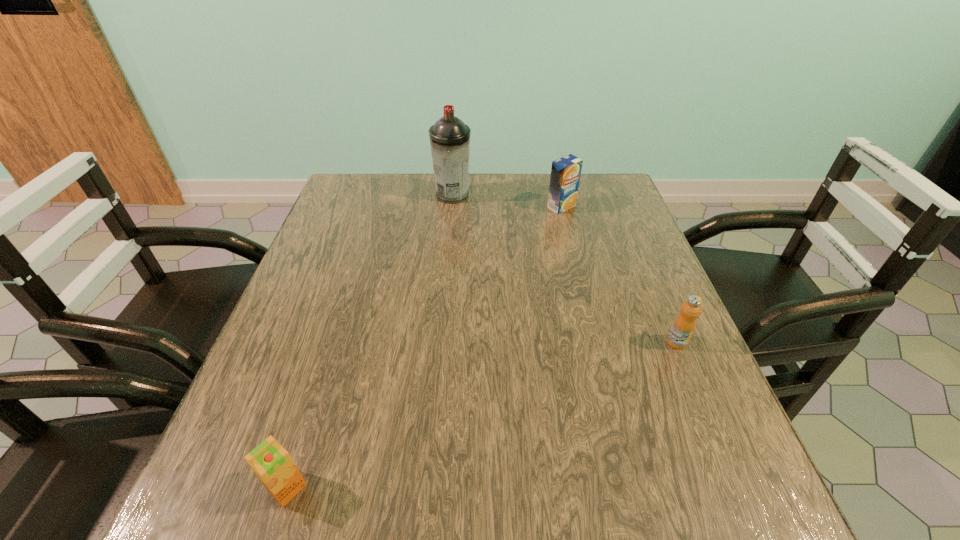
This screenshot has height=540, width=960. I want to click on the second object from left to right, so click(449, 137).

Locate an element on the screen. The image size is (960, 540). aerosol can is located at coordinates (449, 137).

Find the location of `the third shortest object`. the third shortest object is located at coordinates (565, 173).

Find the location of a particular element. This screenshot has height=540, width=960. the tallest orange juice is located at coordinates (565, 173).

At what (x,y) coordinates should I click in order to perform the action: click on the second nearest orange juice. Please return your answer as a coordinate pair (x, y). Looking at the image, I should click on (684, 325).

The width and height of the screenshot is (960, 540). Identify the location of the rightmost object. click(684, 325).

Image resolution: width=960 pixels, height=540 pixels. In order to click on the leftmost orange juice in this screenshot , I will do `click(270, 461)`.

Locate an element on the screen. The width and height of the screenshot is (960, 540). the nearest orange juice is located at coordinates (270, 461).

In order to click on free spot located 0.240m on the front of the aerosol can in this screenshot , I will do `click(447, 260)`.

You are a GUI agent. You are given a task and a screenshot of the screen. Output one action in this format:
    pyautogui.click(x=<x>, y=<y>)
    Task: Click on the free space located 0.390m on the left of the farthest orange juice
    The height and width of the screenshot is (540, 960).
    Given the screenshot: What is the action you would take?
    pyautogui.click(x=409, y=206)